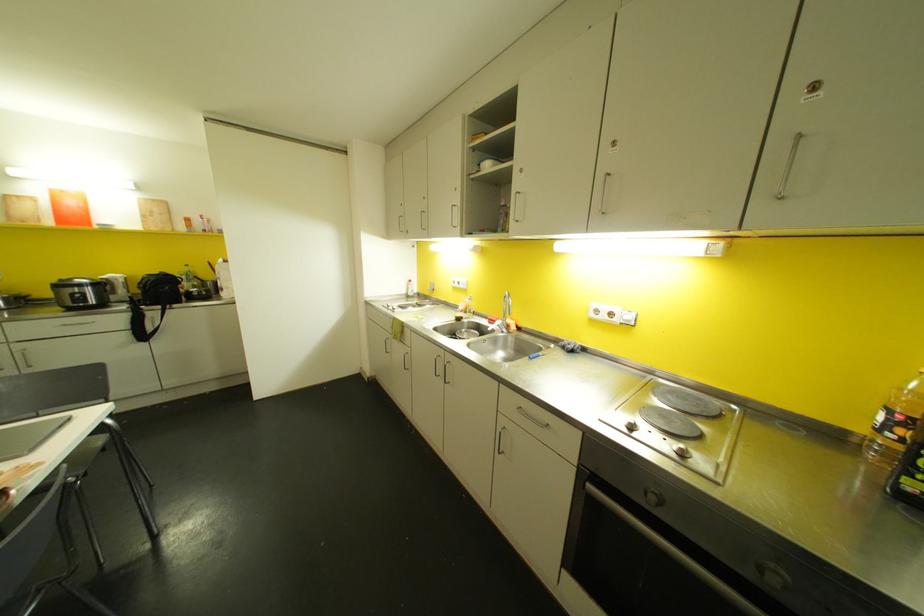
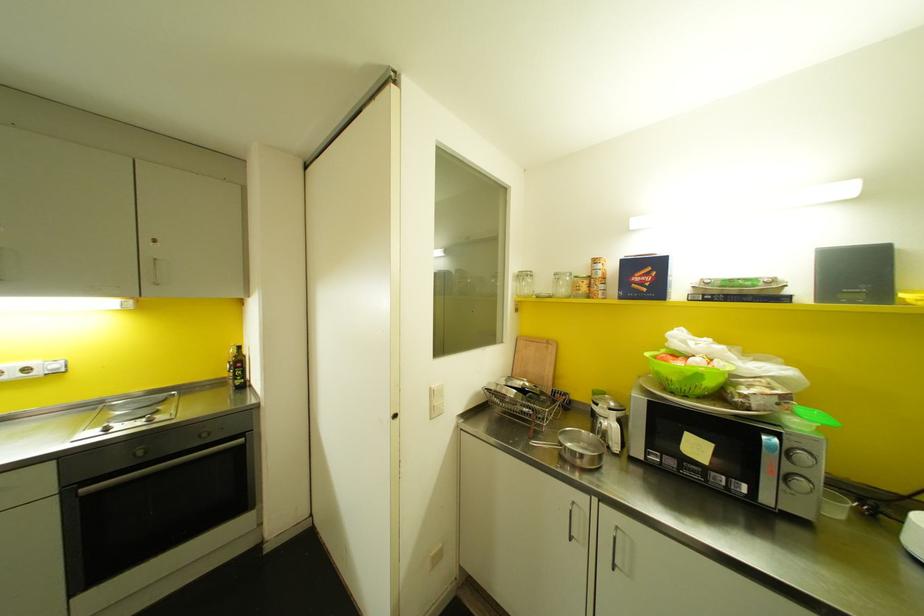
In the second image, find the point that corresponds to the point at 630,428 in the first image.

(106, 429)